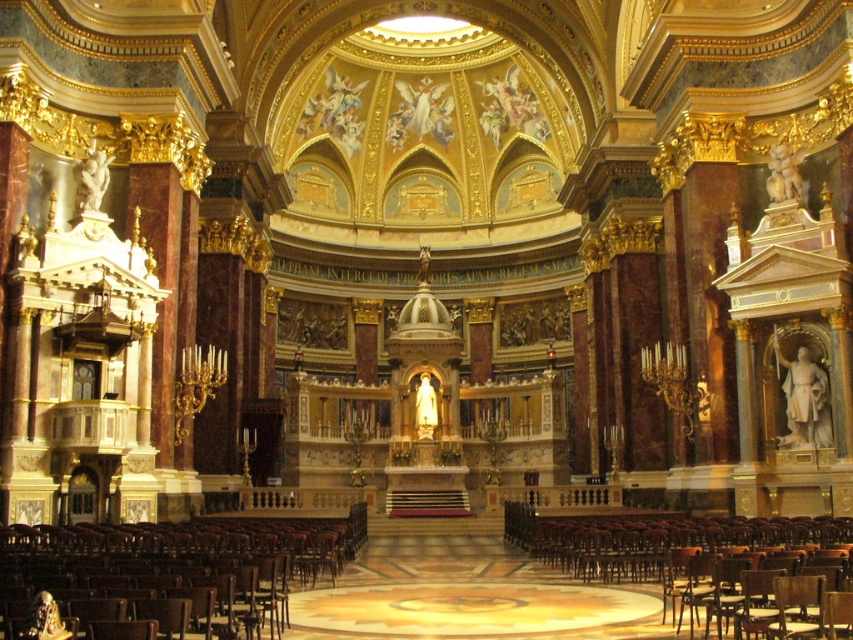
Question: Is wooden polished chair at lower left smaller than wooden polished chair at lower right?

Choices:
 (A) no
 (B) yes

Answer: (B)

Question: Which point is closer to the camera?

Choices:
 (A) wooden polished chair at lower right
 (B) wooden polished chair at lower left

Answer: (B)

Question: Can you confirm if wooden polished chair at lower left is wider than wooden polished chair at lower right?

Choices:
 (A) no
 (B) yes

Answer: (B)

Question: Which object appears closest to the camera in this image?

Choices:
 (A) wooden polished chair at lower right
 (B) wooden polished chair at lower left

Answer: (B)

Question: Does wooden polished chair at lower left have a lesser width compared to wooden polished chair at lower right?

Choices:
 (A) no
 (B) yes

Answer: (A)